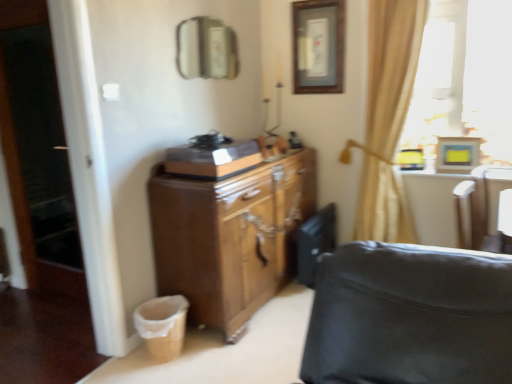
Question: Should I look upward or downward to see wooden cabinet at center?

Choices:
 (A) down
 (B) up

Answer: (B)

Question: From a real-world perspective, does wooden picture frame at upper center, marked as the 2th picture frame in a bottom-to-top arrangement, sit lower than beige fabric curtain at upper right?

Choices:
 (A) yes
 (B) no

Answer: (B)

Question: Is wooden picture frame at upper center, the first picture frame from the top, facing away from beige fabric curtain at upper right?

Choices:
 (A) yes
 (B) no

Answer: (B)

Question: Is wooden picture frame at upper center, the first picture frame from the top, smaller than beige fabric curtain at upper right?

Choices:
 (A) no
 (B) yes

Answer: (B)

Question: Is wooden picture frame at upper center, marked as the 1th picture frame in a back-to-front arrangement, not within beige fabric curtain at upper right?

Choices:
 (A) yes
 (B) no

Answer: (A)

Question: From the image's perspective, is wooden picture frame at upper center, acting as the 1th picture frame starting from the left, above beige fabric curtain at upper right?

Choices:
 (A) no
 (B) yes

Answer: (B)

Question: From the image's perspective, is wooden picture frame at upper center, marked as the 2th picture frame in a bottom-to-top arrangement, below beige fabric curtain at upper right?

Choices:
 (A) yes
 (B) no

Answer: (B)

Question: Does brown wood cabinet at center appear on the left side of white leather swivel chair at right?

Choices:
 (A) yes
 (B) no

Answer: (A)

Question: From the image's perspective, is brown wood cabinet at center below white leather swivel chair at right?

Choices:
 (A) no
 (B) yes

Answer: (B)

Question: Is brown wood cabinet at center positioned before white leather swivel chair at right?

Choices:
 (A) no
 (B) yes

Answer: (A)

Question: Is brown wood cabinet at center further to the viewer compared to white leather swivel chair at right?

Choices:
 (A) no
 (B) yes

Answer: (B)

Question: Considering the relative positions of brown wood cabinet at center and white leather swivel chair at right in the image provided, is brown wood cabinet at center to the right of white leather swivel chair at right from the viewer's perspective?

Choices:
 (A) yes
 (B) no

Answer: (B)

Question: Does brown wood cabinet at center have a larger size compared to white leather swivel chair at right?

Choices:
 (A) no
 (B) yes

Answer: (B)

Question: From the image's perspective, does white leather swivel chair at right appear lower than metallic rectangular mirror at upper center?

Choices:
 (A) yes
 (B) no

Answer: (A)